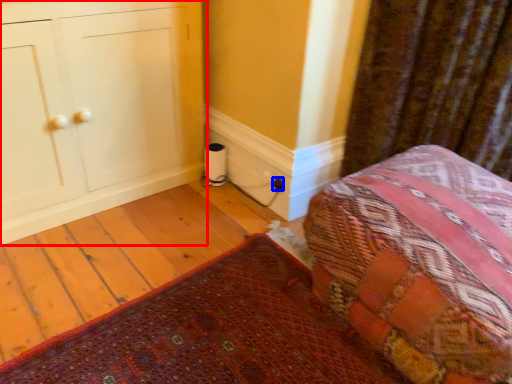
Question: Which object appears closest to the camera in this image, furniture (highlighted by a red box) or electric outlet (highlighted by a blue box)?

Choices:
 (A) furniture
 (B) electric outlet

Answer: (A)